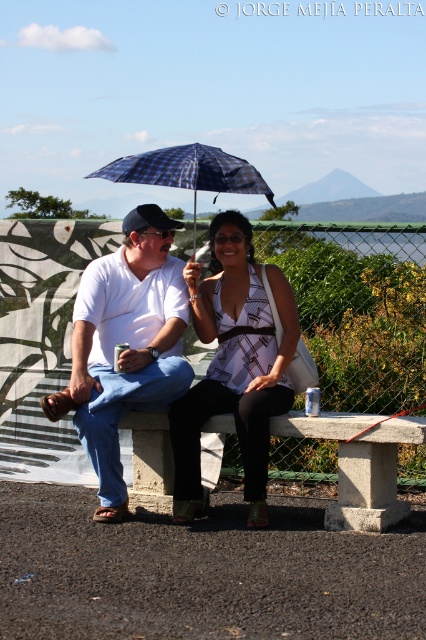
Question: Is matte white shirt at center bigger than patterned fabric blouse at center?

Choices:
 (A) yes
 (B) no

Answer: (A)

Question: Can you confirm if concrete bench at center is positioned above blue plaid umbrella at center?

Choices:
 (A) yes
 (B) no

Answer: (B)

Question: Which of the following is the closest to the observer?

Choices:
 (A) (189, 180)
 (B) (417, 429)

Answer: (B)

Question: Is patterned fabric blouse at center to the right of concrete bench at center from the viewer's perspective?

Choices:
 (A) no
 (B) yes

Answer: (A)

Question: Which point is farther to the camera?

Choices:
 (A) matte white shirt at center
 (B) blue plaid umbrella at center
 (C) patterned fabric blouse at center

Answer: (B)

Question: Which is nearer to the patterned fabric blouse at center?

Choices:
 (A) matte white shirt at center
 (B) concrete bench at center

Answer: (A)